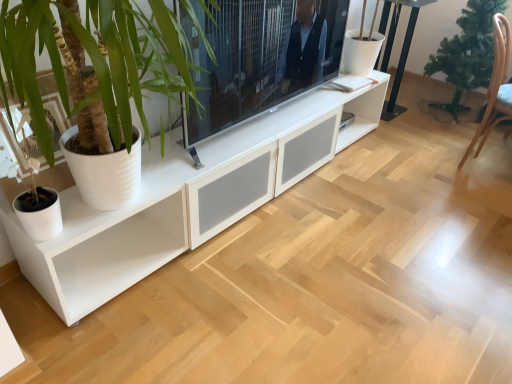
Image resolution: width=512 pixels, height=384 pixels. I want to click on empty space that is to the right of black metal table at upper right, so click(x=411, y=113).